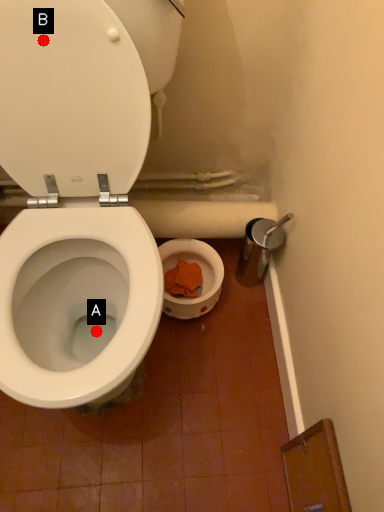
Question: Two points are circled on the image, labeled by A and B beside each circle. Which of the following is the closest to the observer?

Choices:
 (A) A is closer
 (B) B is closer

Answer: (B)